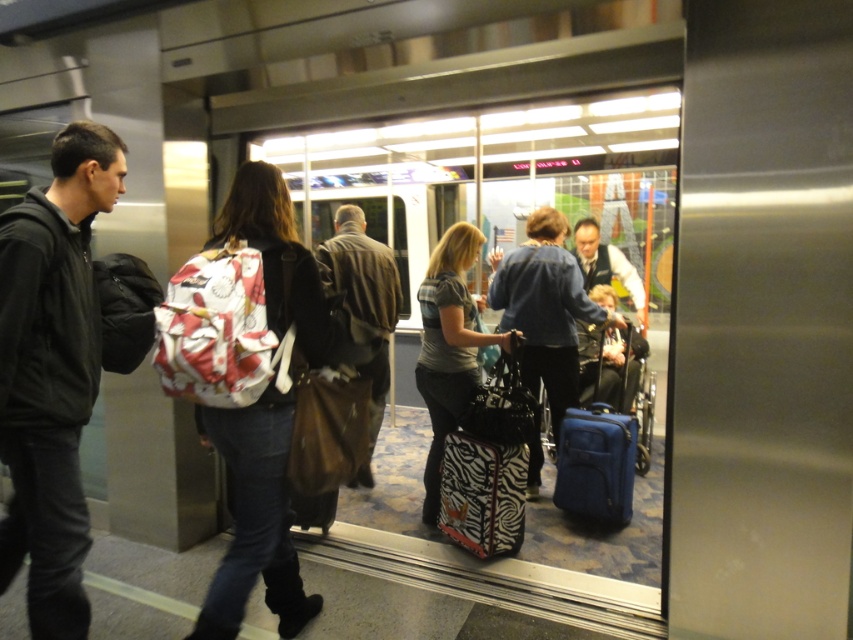
You are a person standing at the entrance of the train station and want to locate the blue fabric wheelchair at center. Which direction should you look to find it, considering the position of the black matte jacket at left?

The blue fabric wheelchair at center is located to the right of the black matte jacket at left, so you should look to the right direction from the black matte jacket at left to find it.

You are standing at the entrance of the train station and see a blue fabric suitcase at center. Can you tell me where exactly the point with coordinates (596, 456) is located?

The point with coordinates (596, 456) is located on the blue fabric suitcase at center.